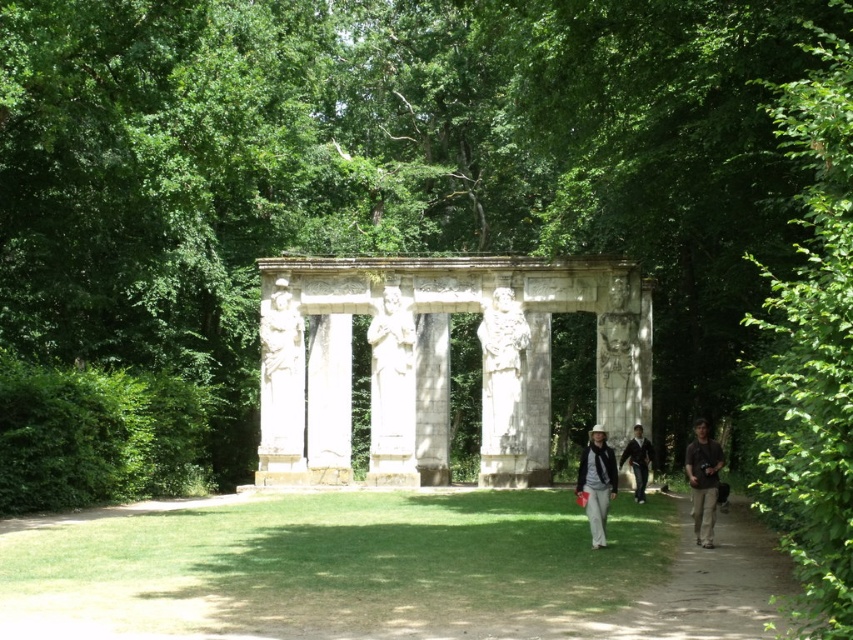
You are standing at the base of the classical stone structure in the park. You see a matte black jacket at lower right and dark blue jeans at center. Which object is closer to you?

The dark blue jeans at center is closer to you since the matte black jacket at lower right is 6.11 meters away from it, meaning the jeans are nearer in proximity.

You are standing at a point in a park and want to reach a classical stone structure with four columns. The structure is located at point (712, 461). If you start walking straight towards it from your current position, how far will you have to walk?

The distance between your current position and the classical stone structure at point (712, 461) is 77.75 meters, so you will have to walk 77.75 meters to reach it.

You are a photographer aiming to capture a clear shot of the classical stone structure in the park. You notice a matte black jacket at lower right and dark blue jeans at center blocking your view. Which object is closer to the right side of your frame?

The matte black jacket at lower right is positioned on the right side of dark blue jeans at center, so it is closer to the right side of the frame.